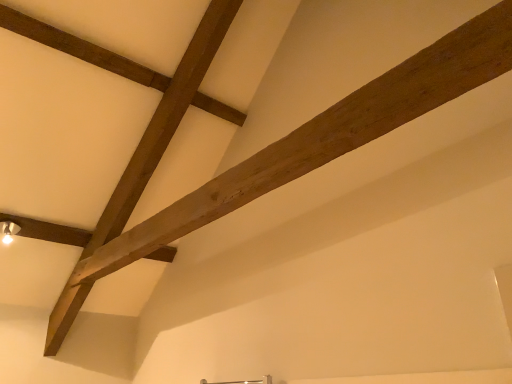
This screenshot has width=512, height=384. I want to click on matte white light fixture at upper left, so click(8, 231).

What do you see at coordinates (8, 231) in the screenshot? I see `matte white light fixture at upper left` at bounding box center [8, 231].

The image size is (512, 384). Find the location of `matte white light fixture at upper left`. matte white light fixture at upper left is located at coordinates (8, 231).